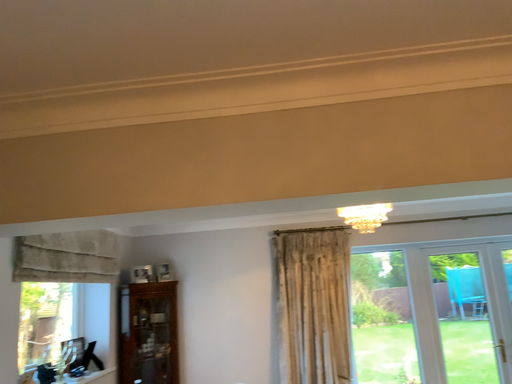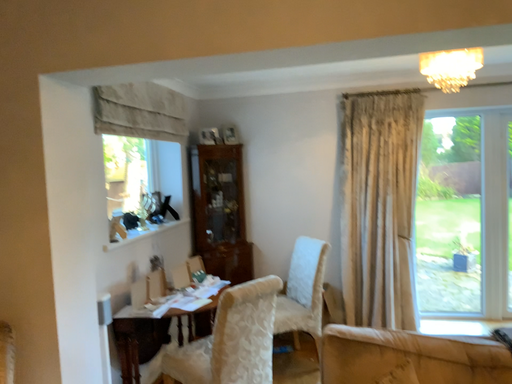
Question: Which way did the camera rotate in the video?

Choices:
 (A) rotated left
 (B) rotated right

Answer: (A)